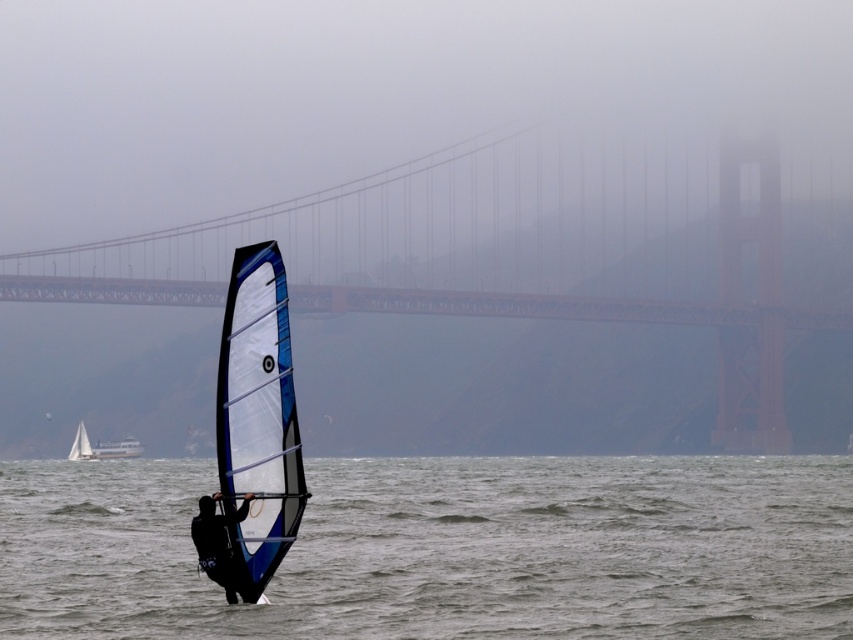
Does translucent blue water at center appear on the right side of red metal bridge at center?

Incorrect, translucent blue water at center is not on the right side of red metal bridge at center.

Between point (363, 618) and point (691, 321), which one is positioned in front?

Point (363, 618) is more forward.

Is point (585, 586) closer to camera compared to point (776, 348)?

Yes, point (585, 586) is closer to viewer.

Image resolution: width=853 pixels, height=640 pixels. What are the coordinates of `translucent blue water at center` in the screenshot? It's located at (445, 548).

Between translucent blue water at center and white sailboat at lower left, which one appears on the right side from the viewer's perspective?

translucent blue water at center is more to the right.

Who is shorter, translucent blue water at center or white sailboat at lower left?

white sailboat at lower left

Does point (744, 604) come farther from viewer compared to point (85, 438)?

No.

You are a GUI agent. You are given a task and a screenshot of the screen. Output one action in this format:
    pyautogui.click(x=<x>, y=<y>)
    Task: Click on the translucent blue water at center
    This screenshot has height=640, width=853.
    Given the screenshot: What is the action you would take?
    coord(445,548)

Can you confirm if blue/white composite sail at center is smaller than white plastic boat at lower left?

Yes, blue/white composite sail at center is smaller than white plastic boat at lower left.

Which is in front, point (223, 337) or point (137, 442)?

Positioned in front is point (223, 337).

Identify the location of blue/white composite sail at center. The image size is (853, 640). (257, 419).